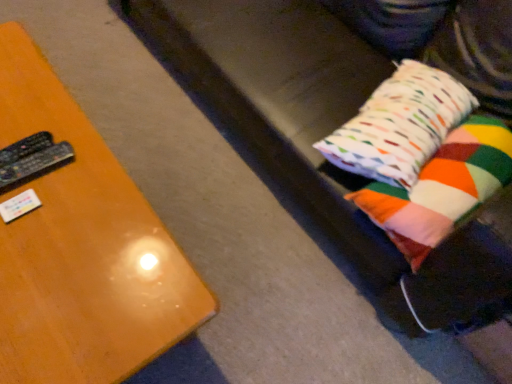
What do you see at coordinates (82, 249) in the screenshot?
I see `wooden table at left` at bounding box center [82, 249].

Measure the distance between point (42, 158) and camera.

The distance of point (42, 158) from camera is 3.41 feet.

This screenshot has width=512, height=384. What are the coordinates of `multicolored fabric pillow at right, which is counted as the 2th pillow, starting from the top` in the screenshot? It's located at (442, 188).

In order to click on black plastic remote at left, which is the second remote in bottom-to-top order in this screenshot , I will do `click(25, 148)`.

I want to click on wooden table at left, so click(x=82, y=249).

From the image's perspective, does wooden table at left appear higher than multicolored fabric pillow at right, the 1th pillow from the top?

No, from the image's perspective, wooden table at left is not over multicolored fabric pillow at right, the 1th pillow from the top.

Which is closer to the camera, (74, 235) or (414, 137)?

Point (74, 235) is closer to the camera than point (414, 137).

Is wooden table at left further to camera compared to multicolored fabric pillow at right, which is the 2th pillow in bottom-to-top order?

No, wooden table at left is closer to the viewer.

Is black plastic remote at left, placed as the 1th remote when sorted from top to bottom, directly adjacent to multicolored fabric pillow at right, which is counted as the 2th pillow, starting from the top?

No.

From the image's perspective, which object appears higher, black plastic remote at left, placed as the 1th remote when sorted from top to bottom, or multicolored fabric pillow at right, which is counted as the 2th pillow, starting from the top?

black plastic remote at left, placed as the 1th remote when sorted from top to bottom, appears higher in the image.

Find the location of a particular element. the 2nd remote behind the multicolored fabric pillow at right, arranged as the 1th pillow when ordered from the bottom is located at coordinates (25, 148).

Is black plastic remote at left, placed as the 1th remote when sorted from top to bottom, positioned beyond the bounds of multicolored fabric pillow at right, which is counted as the 2th pillow, starting from the top?

black plastic remote at left, placed as the 1th remote when sorted from top to bottom, lies outside multicolored fabric pillow at right, which is counted as the 2th pillow, starting from the top,'s area.

Is multicolored fabric pillow at right, which is the 2th pillow in bottom-to-top order, next to wooden table at left and touching it?

They are not placed beside each other.

From a real-world perspective, is multicolored fabric pillow at right, the 1th pillow from the top, below wooden table at left?

No, from a real-world perspective, multicolored fabric pillow at right, the 1th pillow from the top, is not under wooden table at left.

In terms of width, does multicolored fabric pillow at right, which is the 2th pillow in bottom-to-top order, look wider or thinner when compared to wooden table at left?

Result: Considering their sizes, multicolored fabric pillow at right, which is the 2th pillow in bottom-to-top order, looks slimmer than wooden table at left.

Considering the relative sizes of multicolored fabric pillow at right, the 1th pillow from the top, and wooden table at left in the image provided, is multicolored fabric pillow at right, the 1th pillow from the top, bigger than wooden table at left?

No.

Is point (14, 149) positioned after point (4, 170)?

Yes, it is behind point (4, 170).

Is black plastic remote at left, which is counted as the 1th remote, starting from the bottom, at the back of black plastic remote at left, which is the second remote in bottom-to-top order?

black plastic remote at left, which is the second remote in bottom-to-top order, is not turned away from black plastic remote at left, which is counted as the 1th remote, starting from the bottom.

From the image's perspective, does black plastic remote at left, which is the second remote in bottom-to-top order, appear lower than black plastic remote at left, which is counted as the 1th remote, starting from the bottom?

Incorrect, from the image's perspective, black plastic remote at left, which is the second remote in bottom-to-top order, is higher than black plastic remote at left, which is counted as the 1th remote, starting from the bottom.

Based on the photo, from a real-world perspective, who is located higher, black plastic remote at left, which is the second remote in bottom-to-top order, or black plastic remote at left, placed as the second remote when sorted from top to bottom?

black plastic remote at left, placed as the second remote when sorted from top to bottom, from a real-world perspective.

From a real-world perspective, is multicolored fabric pillow at right, which is counted as the 2th pillow, starting from the top, below multicolored fabric pillow at right, which is the 2th pillow in bottom-to-top order?

Yes.

Considering the positions of point (454, 223) and point (379, 143), is point (454, 223) closer or farther from the camera than point (379, 143)?

Point (454, 223) appears to be closer to the viewer than point (379, 143).

Image resolution: width=512 pixels, height=384 pixels. Find the location of `pillow on the left of the multicolored fabric pillow at right, arranged as the 1th pillow when ordered from the bottom`. pillow on the left of the multicolored fabric pillow at right, arranged as the 1th pillow when ordered from the bottom is located at coordinates (400, 125).

From the image's perspective, which one is positioned higher, multicolored fabric pillow at right, arranged as the 1th pillow when ordered from the bottom, or multicolored fabric pillow at right, which is the 2th pillow in bottom-to-top order?

multicolored fabric pillow at right, which is the 2th pillow in bottom-to-top order, is shown above in the image.

Could you tell me if multicolored fabric pillow at right, which is the 2th pillow in bottom-to-top order, is turned towards black plastic remote at left, which is the second remote in bottom-to-top order?

No.

Considering the positions of point (394, 97) and point (0, 158), is point (394, 97) closer or farther from the camera than point (0, 158)?

Point (394, 97).

Would you say black plastic remote at left, placed as the 1th remote when sorted from top to bottom, is part of multicolored fabric pillow at right, which is the 2th pillow in bottom-to-top order,'s contents?

Actually, black plastic remote at left, placed as the 1th remote when sorted from top to bottom, is outside multicolored fabric pillow at right, which is the 2th pillow in bottom-to-top order.

From the image's perspective, which one is positioned lower, multicolored fabric pillow at right, the 1th pillow from the top, or black plastic remote at left, placed as the 1th remote when sorted from top to bottom?

black plastic remote at left, placed as the 1th remote when sorted from top to bottom, is shown below in the image.

Considering the relative positions of black plastic remote at left, which is counted as the 1th remote, starting from the bottom, and multicolored fabric pillow at right, the 1th pillow from the top, in the image provided, is black plastic remote at left, which is counted as the 1th remote, starting from the bottom, to the left or to the right of multicolored fabric pillow at right, the 1th pillow from the top,?

black plastic remote at left, which is counted as the 1th remote, starting from the bottom, is to the left of multicolored fabric pillow at right, the 1th pillow from the top.

Considering the sizes of black plastic remote at left, placed as the second remote when sorted from top to bottom, and multicolored fabric pillow at right, the 1th pillow from the top, in the image, is black plastic remote at left, placed as the second remote when sorted from top to bottom, bigger or smaller than multicolored fabric pillow at right, the 1th pillow from the top,?

Clearly, black plastic remote at left, placed as the second remote when sorted from top to bottom, is smaller in size than multicolored fabric pillow at right, the 1th pillow from the top.

Is point (11, 171) farther from viewer compared to point (422, 152)?

No, it is in front of (422, 152).

The width and height of the screenshot is (512, 384). Identify the location of the 2nd pillow positioned above the wooden table at left (from the image's perspective). (400, 125).

There is a multicolored fabric pillow at right, arranged as the 1th pillow when ordered from the bottom. Find the location of `the 2nd remote below it (from a real-world perspective)`. the 2nd remote below it (from a real-world perspective) is located at coordinates (25, 148).

Based on their spatial positions, is black plastic remote at left, placed as the second remote when sorted from top to bottom, or multicolored fabric pillow at right, which is counted as the 2th pillow, starting from the top, further from multicolored fabric pillow at right, which is the 2th pillow in bottom-to-top order?

black plastic remote at left, placed as the second remote when sorted from top to bottom, is further to multicolored fabric pillow at right, which is the 2th pillow in bottom-to-top order.

Looking at the image, which one is located further to multicolored fabric pillow at right, the 1th pillow from the top, wooden table at left or black plastic remote at left, which is counted as the 1th remote, starting from the bottom?

black plastic remote at left, which is counted as the 1th remote, starting from the bottom, is positioned further to the anchor multicolored fabric pillow at right, the 1th pillow from the top.

Estimate the real-world distances between objects in this image. Which object is further from black plastic remote at left, placed as the second remote when sorted from top to bottom, multicolored fabric pillow at right, arranged as the 1th pillow when ordered from the bottom, or wooden table at left?

multicolored fabric pillow at right, arranged as the 1th pillow when ordered from the bottom, is positioned further to the anchor black plastic remote at left, placed as the second remote when sorted from top to bottom.

Consider the image. Looking at the image, which one is located closer to black plastic remote at left, placed as the second remote when sorted from top to bottom, multicolored fabric pillow at right, the 1th pillow from the top, or wooden table at left?

wooden table at left is positioned closer to the anchor black plastic remote at left, placed as the second remote when sorted from top to bottom.

Estimate the real-world distances between objects in this image. Which object is closer to wooden table at left, multicolored fabric pillow at right, which is the 2th pillow in bottom-to-top order, or multicolored fabric pillow at right, which is counted as the 2th pillow, starting from the top?

The object closer to wooden table at left is multicolored fabric pillow at right, which is counted as the 2th pillow, starting from the top.

Estimate the real-world distances between objects in this image. Which object is further from black plastic remote at left, which is counted as the 1th remote, starting from the bottom, black plastic remote at left, which is the second remote in bottom-to-top order, or multicolored fabric pillow at right, which is counted as the 2th pillow, starting from the top?

multicolored fabric pillow at right, which is counted as the 2th pillow, starting from the top, is further to black plastic remote at left, which is counted as the 1th remote, starting from the bottom.

In the scene shown: Estimate the real-world distances between objects in this image. Which object is further from black plastic remote at left, placed as the 1th remote when sorted from top to bottom, black plastic remote at left, placed as the second remote when sorted from top to bottom, or wooden table at left?

The object further to black plastic remote at left, placed as the 1th remote when sorted from top to bottom, is wooden table at left.

Looking at the image, which one is located further to multicolored fabric pillow at right, arranged as the 1th pillow when ordered from the bottom, wooden table at left or black plastic remote at left, placed as the 1th remote when sorted from top to bottom?

Based on the image, black plastic remote at left, placed as the 1th remote when sorted from top to bottom, appears to be further to multicolored fabric pillow at right, arranged as the 1th pillow when ordered from the bottom.

Where is `pillow located between black plastic remote at left, which is the second remote in bottom-to-top order, and multicolored fabric pillow at right, which is counted as the 2th pillow, starting from the top, in the left-right direction`? This screenshot has height=384, width=512. pillow located between black plastic remote at left, which is the second remote in bottom-to-top order, and multicolored fabric pillow at right, which is counted as the 2th pillow, starting from the top, in the left-right direction is located at coordinates (400, 125).

Locate an element on the screen. The image size is (512, 384). remote between black plastic remote at left, which is the second remote in bottom-to-top order, and multicolored fabric pillow at right, which is counted as the 2th pillow, starting from the top, from left to right is located at coordinates (35, 163).

Where is `pillow between wooden table at left and multicolored fabric pillow at right, which is counted as the 2th pillow, starting from the top`? pillow between wooden table at left and multicolored fabric pillow at right, which is counted as the 2th pillow, starting from the top is located at coordinates (400, 125).

Identify the location of remote located between black plastic remote at left, which is the second remote in bottom-to-top order, and multicolored fabric pillow at right, the 1th pillow from the top, in the left-right direction. (35, 163).